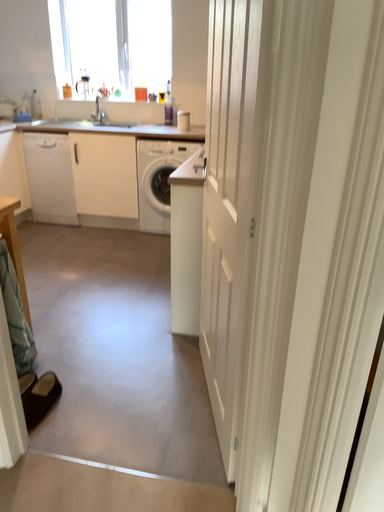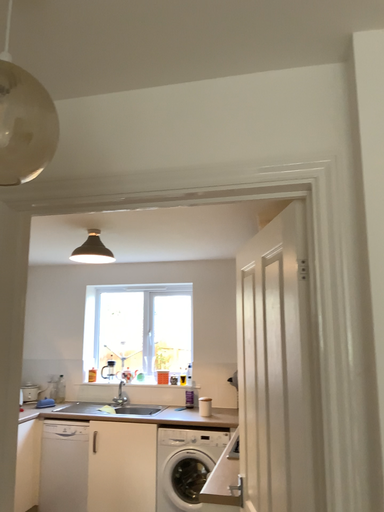
Question: Which way did the camera rotate in the video?

Choices:
 (A) rotated upward
 (B) rotated downward

Answer: (A)